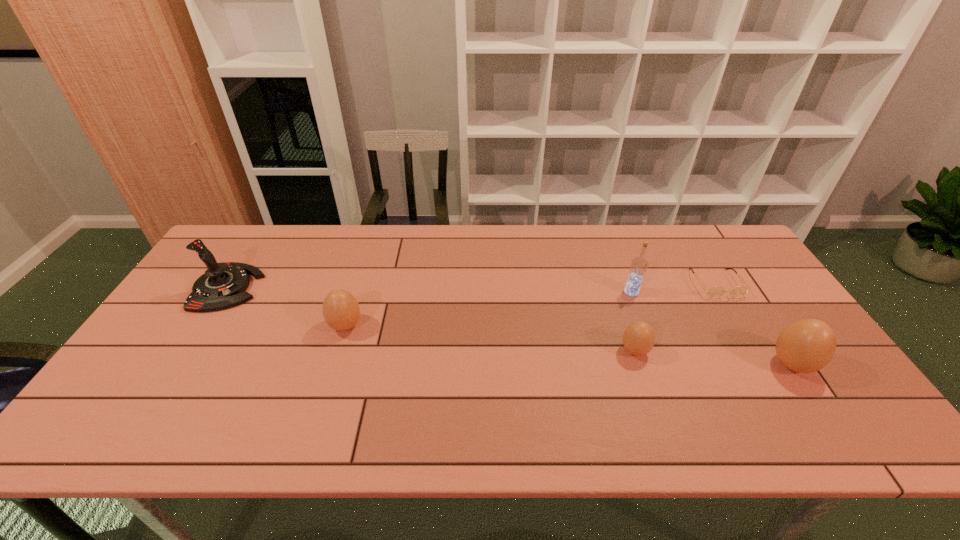
This screenshot has height=540, width=960. What are the coordinates of `empty space that is in between the vodka and the fifth object from right to left` in the screenshot? It's located at (489, 309).

Identify the location of empty space between the spectacles and the shortest boiled egg. The width and height of the screenshot is (960, 540). (675, 317).

Where is `vacant area that lies between the vodka and the fourth shortest object`? This screenshot has height=540, width=960. vacant area that lies between the vodka and the fourth shortest object is located at coordinates (711, 328).

Image resolution: width=960 pixels, height=540 pixels. I want to click on free space between the vodka and the shortest object, so click(673, 288).

The width and height of the screenshot is (960, 540). I want to click on free space that is in between the leftmost boiled egg and the joystick, so click(x=287, y=307).

The height and width of the screenshot is (540, 960). In order to click on vacant area that lies between the vodka and the joystick in this screenshot , I will do `click(430, 290)`.

Identify the location of free spot between the leftmost boiled egg and the joystick. (287, 307).

Locate an element on the screen. Image resolution: width=960 pixels, height=540 pixels. free spot between the second boiled egg from left to right and the shortest object is located at coordinates (675, 317).

Find the location of `vacant point located between the vodka and the fourth farthest object`. vacant point located between the vodka and the fourth farthest object is located at coordinates (489, 309).

In order to click on object that stands as the second closest to the shortest object in this screenshot , I will do `click(808, 345)`.